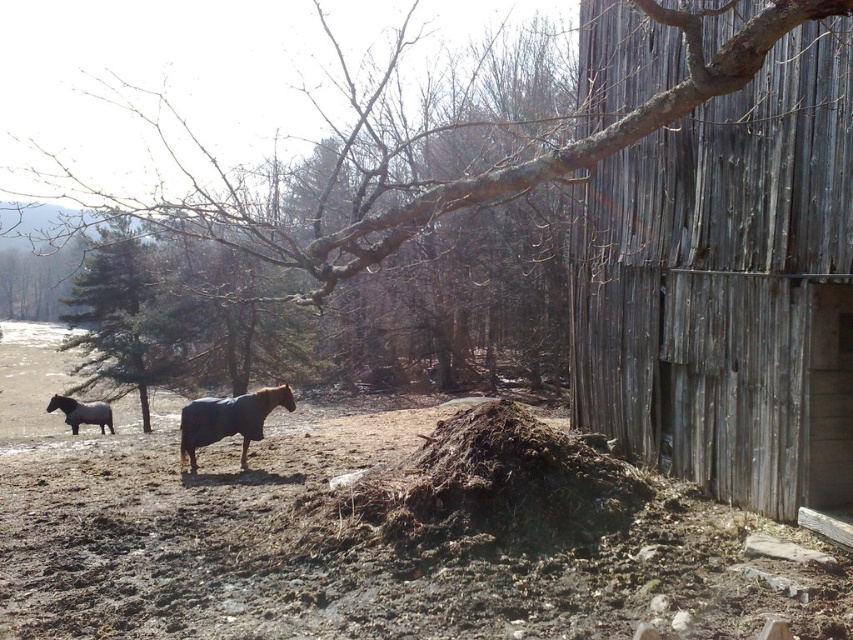
Question: Does weathered wood barn at right have a larger size compared to brown glossy horse at center?

Choices:
 (A) no
 (B) yes

Answer: (B)

Question: Which point appears closest to the camera in this image?

Choices:
 (A) (596, 76)
 (B) (123, 374)
 (C) (248, 412)

Answer: (A)

Question: Observing the image, what is the correct spatial positioning of weathered wood barn at right in reference to green textured pine tree at left?

Choices:
 (A) right
 (B) left

Answer: (A)

Question: Can you confirm if brown bark tree at center is smaller than green textured pine tree at left?

Choices:
 (A) yes
 (B) no

Answer: (B)

Question: Which object appears closest to the camera in this image?

Choices:
 (A) dark brown glossy horse at lower left
 (B) green textured pine tree at left
 (C) weathered wood barn at right

Answer: (C)

Question: Which is nearer to the brown bark tree at center?

Choices:
 (A) green textured pine tree at left
 (B) weathered wood barn at right
 (C) brown glossy horse at center
 (D) dark brown glossy horse at lower left

Answer: (B)